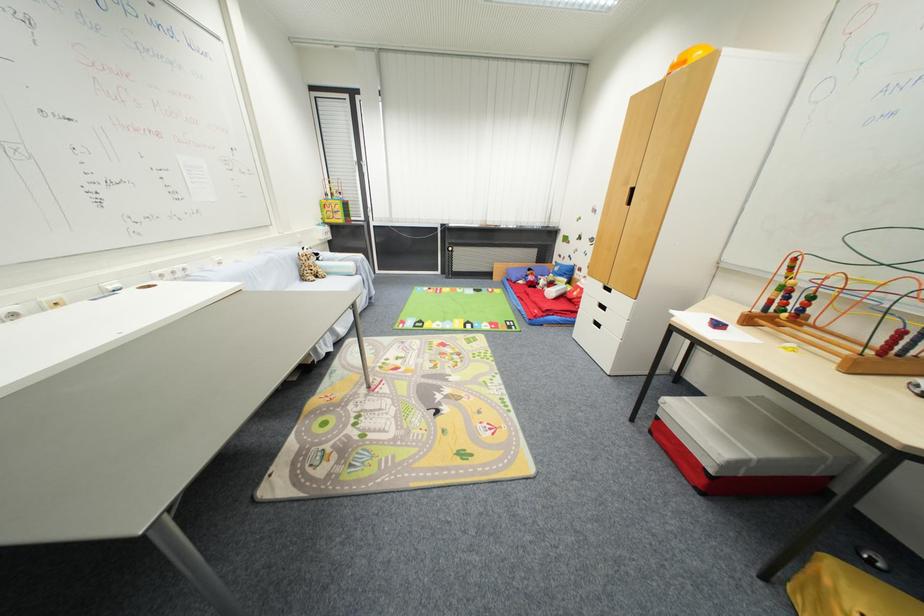
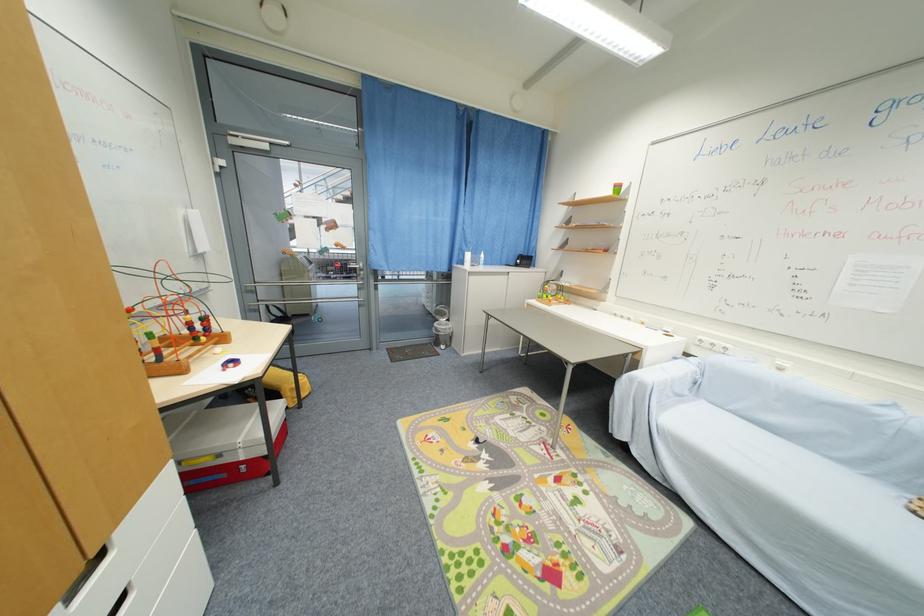
Find the pixel in the second image that matches (166,277) in the first image.

(706, 342)